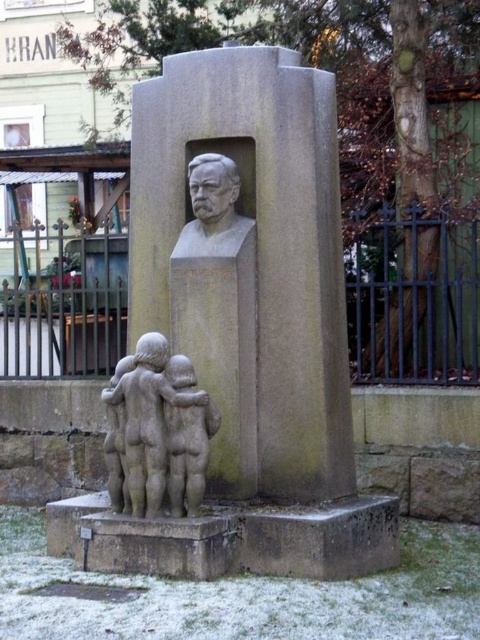
You are standing at the monument and want to take a photo of both the bust of the man and the sculptural group of children. You notice two points marked on the ground at coordinates point (240, 129) and point (186, 385). Which point should you stand at to ensure both the bust and the children are fully visible in your camera frame?

You should stand at point (186, 385) because point (240, 129) is behind it, meaning standing there might block the view of the children or the bust depending on the monument structure.

You are standing in front of the monument and want to take a photo of the gray stone children at lower left. Where should you position yourself to ensure they are centered in your camera viewfinder?

To center the gray stone children at lower left in your camera viewfinder, position yourself directly in front of the monument at the point corresponding to their 2D location at coordinates approximately 0.669 on the x axis and 0.333 on the y axis.

You are standing in front of the monument and want to take a closer look at the gray stone children at lower left. If your maximum comfortable viewing distance is 3 meters, can you move closer to the monument to get a better view?

The gray stone children at lower left is currently 8.46 meters away from you. Since your maximum comfortable viewing distance is 3 meters, you need to move closer by approximately 5.46 meters to be within the desired range.